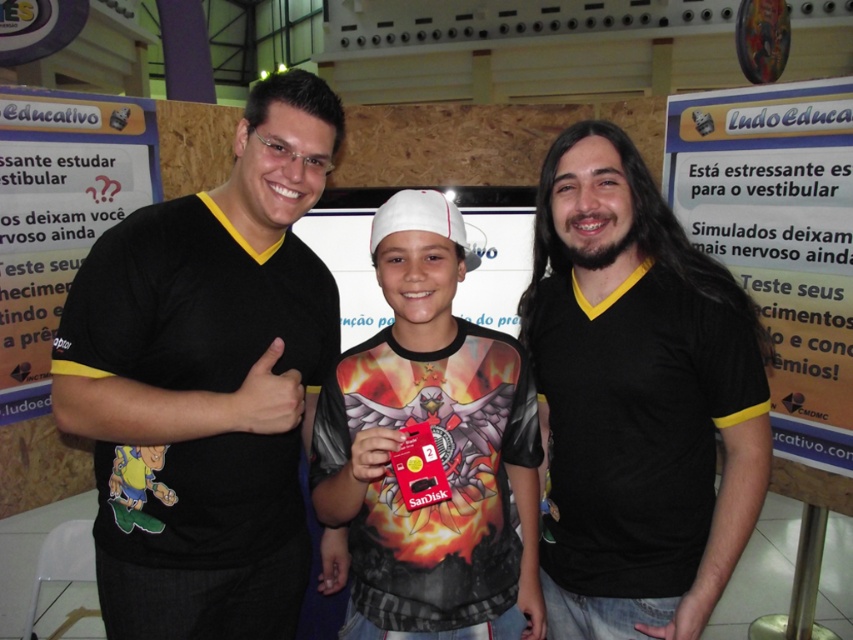
Question: Is the position of black matte t-shirt at left more distant than that of matte black cap at center?

Choices:
 (A) no
 (B) yes

Answer: (B)

Question: Which point is farther from the camera taking this photo?

Choices:
 (A) (184, 616)
 (B) (466, 634)
 (C) (585, 173)

Answer: (A)

Question: Is black matte t-shirt at left bigger than black matte shirt at center?

Choices:
 (A) yes
 (B) no

Answer: (A)

Question: Which point appears farthest from the camera in this image?

Choices:
 (A) (425, 426)
 (B) (241, 176)

Answer: (B)

Question: Which of these objects is positioned closest to the black matte shirt at center?

Choices:
 (A) matte black cap at center
 (B) black matte t-shirt at left

Answer: (A)

Question: In this image, where is black matte t-shirt at left located relative to black matte shirt at center?

Choices:
 (A) left
 (B) right

Answer: (A)